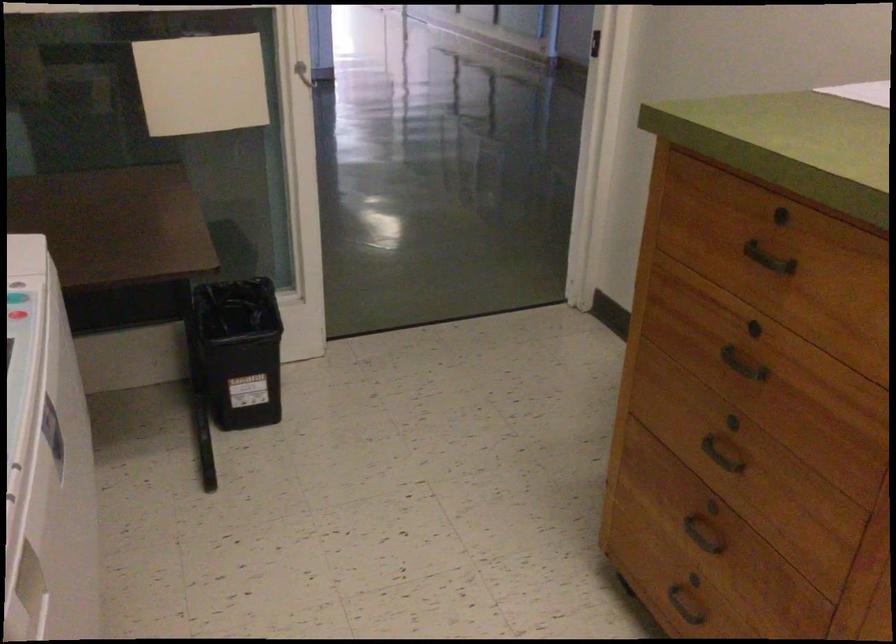
The height and width of the screenshot is (644, 896). I want to click on black trash can, so pos(239,351).